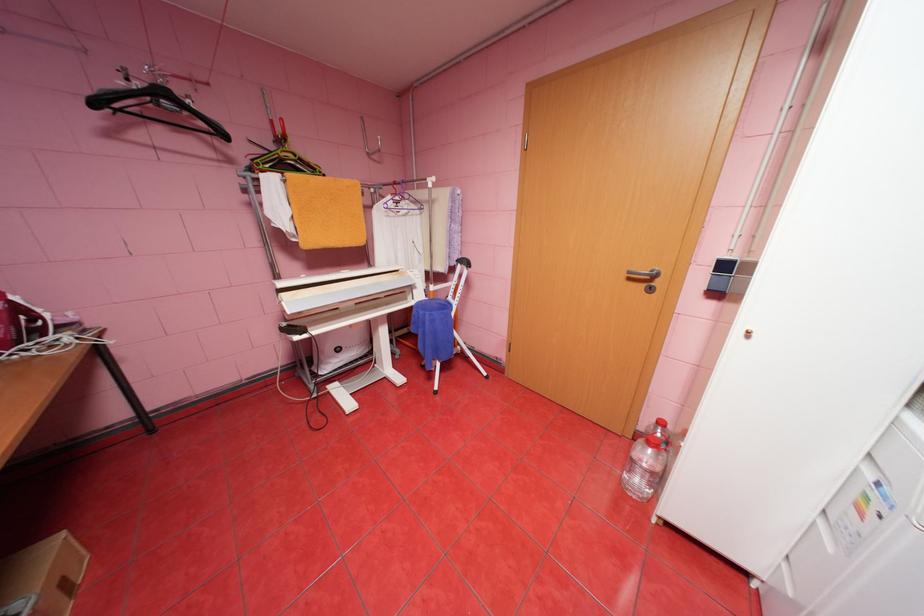
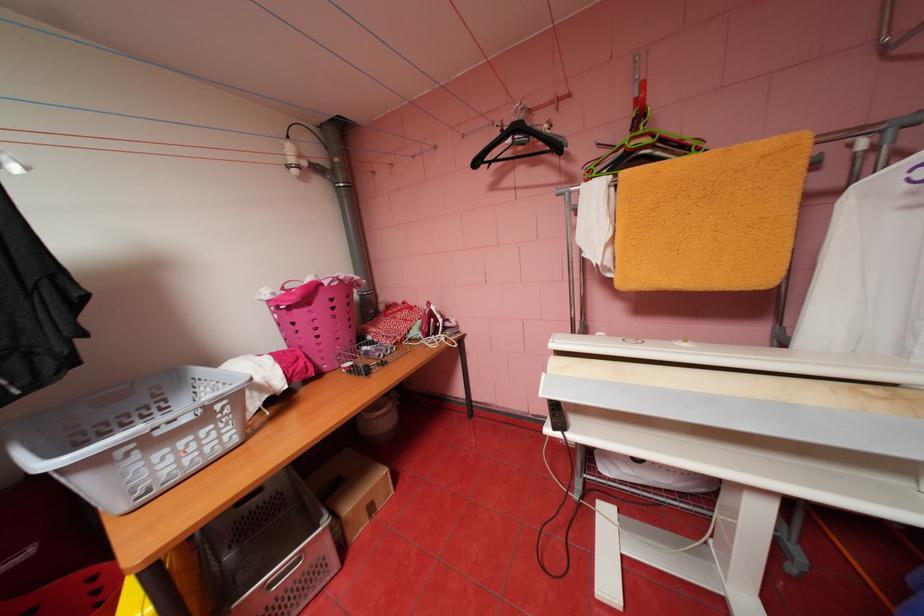
The point at (103, 103) is marked in the first image. Where is the corresponding point in the second image?

(484, 163)